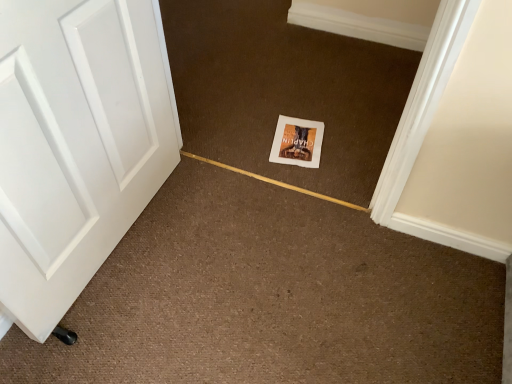
The width and height of the screenshot is (512, 384). What are the coordinates of `vacant region above white paper postcard at center (from a real-world perspective)` in the screenshot? It's located at (300, 137).